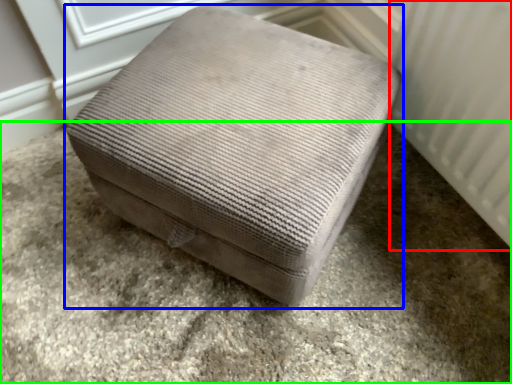
Question: Considering the real-world distances, which object is farthest from radiator (highlighted by a red box)? furniture (highlighted by a blue box) or concrete (highlighted by a green box)?

Choices:
 (A) furniture
 (B) concrete

Answer: (B)